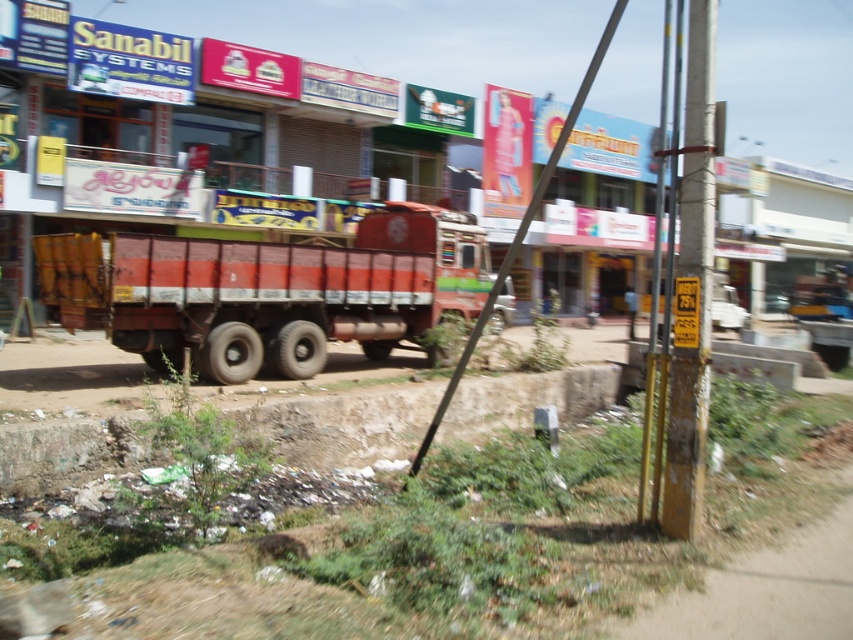
You are a delivery person who needs to park your 2.5 meter long van. You see the red matte truck at center and the brown dirt at lower left. Can you park your van between them without overlapping either?

The distance between the red matte truck at center and the brown dirt at lower left is 5.26 meters. Since your van is 2.5 meters long, there is enough space to park between them without overlapping.

You are a delivery person who needs to place a 20 meter long fence between the brown dirt at lower left and the metallic pole at right. Is there enough space to install the fence between them?

The distance between the brown dirt at lower left and the metallic pole at right is 19.87 meters. Since the fence is 20 meters long, it is slightly too long to fit in the available space between them.